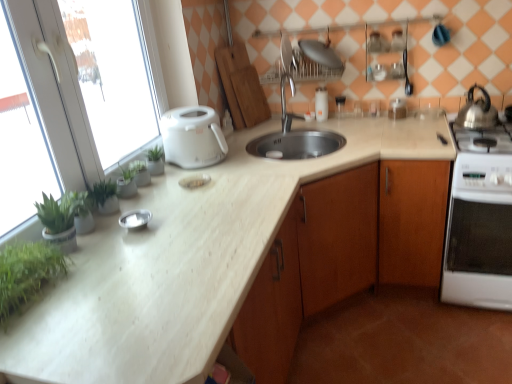
Locate an element on the screen. free space in front of silver metallic bowl at center, which ranks as the fourth appliance in back-to-front order is located at coordinates (128, 247).